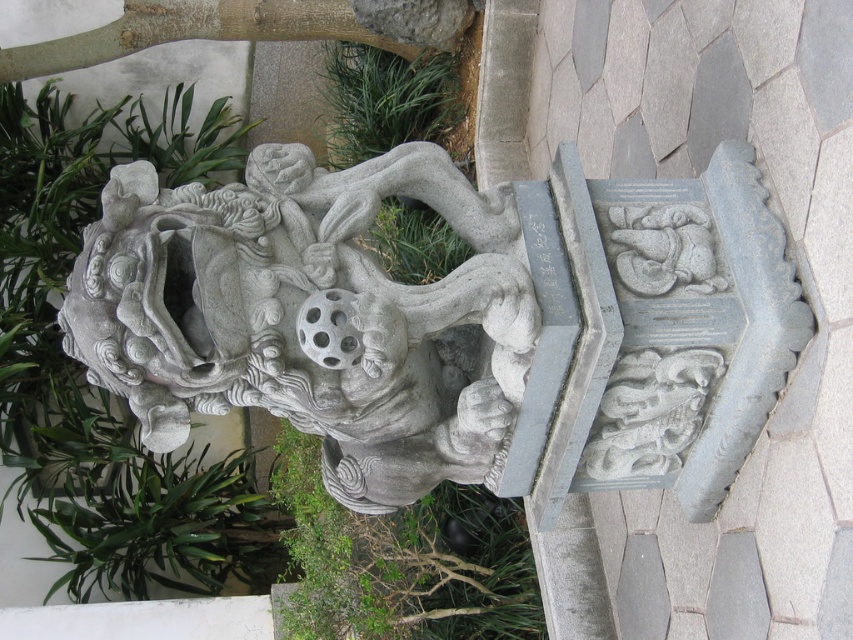
You are standing in front of the stone sculpture of a mythical creature. You notice two points marked on the sculpture. The first point is at coordinates point (346, 260) and the second is at point (502, 536). If you were to touch both points with your finger, which point would your finger reach first as you move from the front of the sculpture towards its back?

Point (346, 260) is in front of point (502, 536), so your finger would reach point (346, 260) first when moving from the front towards the back of the sculpture.

Based on the photo, you are standing in front of the stone sculpture of a mythical creature. There is a point at coordinates point (115, 346). Can you reach this point with your hand if you are 2.21 meters away from it?

The point at coordinates point (115, 346) is 2.21 meters away from the viewer, so you cannot reach it with your hand since the distance is greater than an average person can reach.

You are a gardener looking at the stone sculpture of a mythical creature. You notice a green leafy plant at center and a green grass at upper center. Which object is located below the other?

The green leafy plant at center is positioned under green grass at upper center.